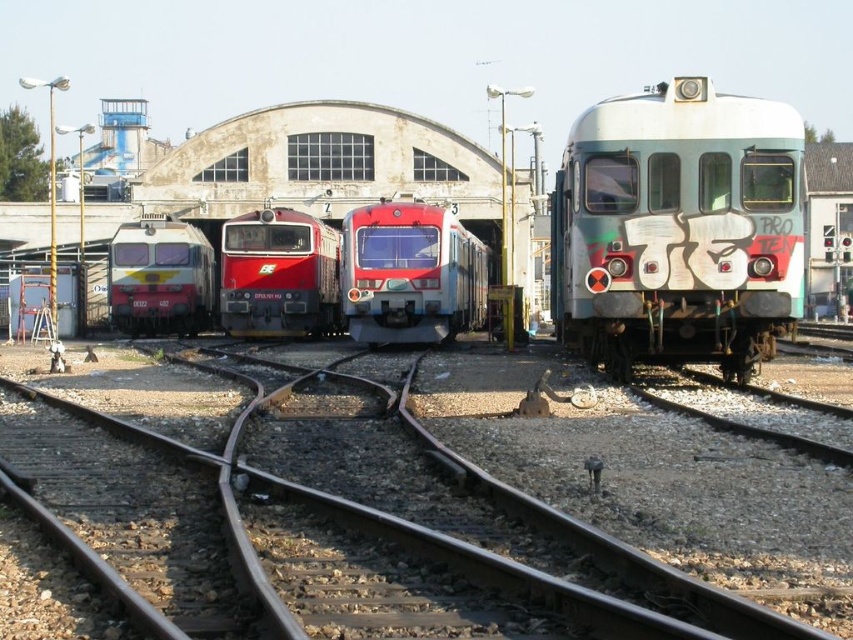
Can you confirm if white matte train at center is positioned to the left of matte red train at center?

Incorrect, white matte train at center is not on the left side of matte red train at center.

The image size is (853, 640). Describe the element at coordinates (677, 228) in the screenshot. I see `white matte train at center` at that location.

Image resolution: width=853 pixels, height=640 pixels. In order to click on white matte train at center in this screenshot , I will do `click(677, 228)`.

Between point (346, 241) and point (223, 292), which one is positioned in front?

Point (346, 241)

You are a GUI agent. You are given a task and a screenshot of the screen. Output one action in this format:
    pyautogui.click(x=<x>, y=<y>)
    Task: Click on the smooth red train at center
    
    Given the screenshot: What is the action you would take?
    pyautogui.click(x=410, y=275)

Does metal at center have a smaller size compared to brushed metal train at left?

Yes.

I want to click on metal at center, so coord(421,538).